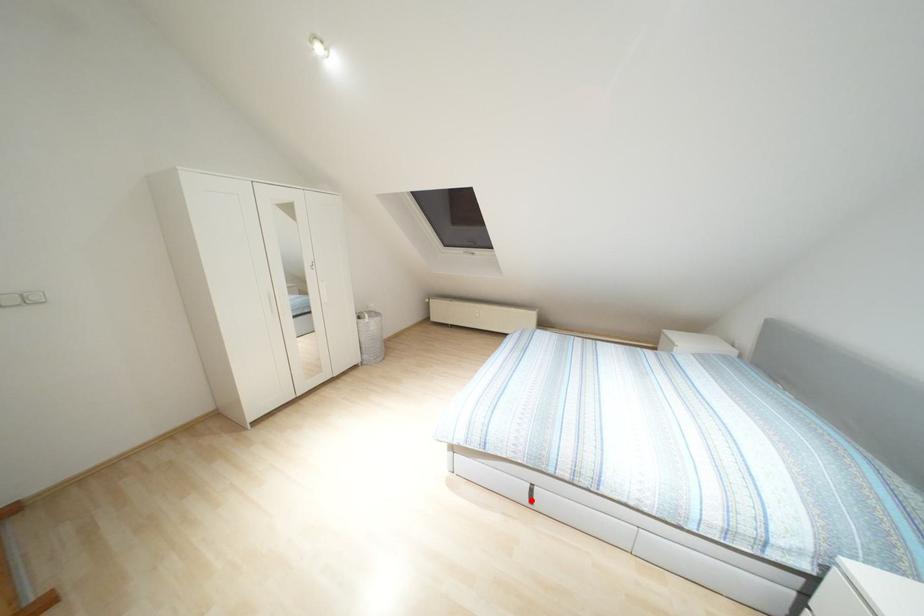
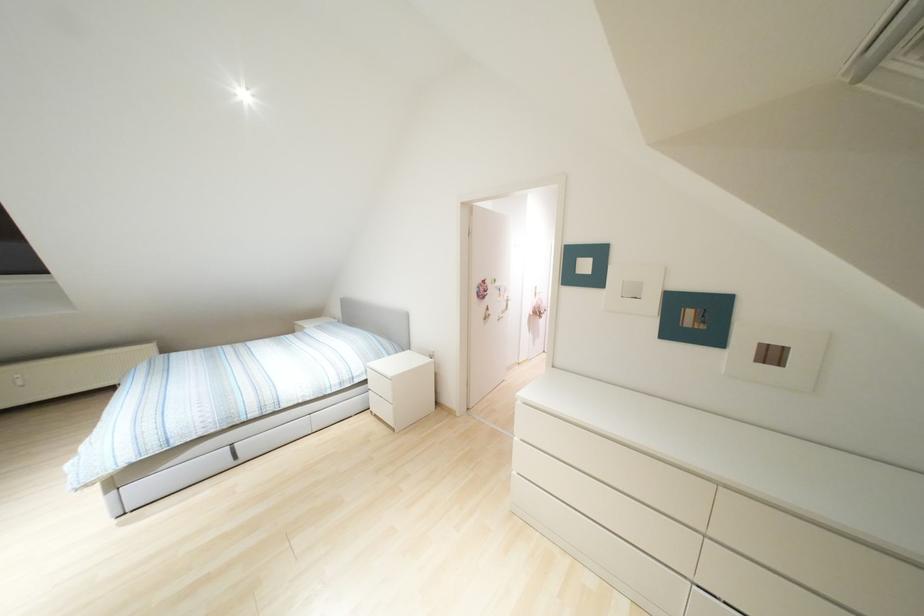
Where in the second image is the point corresponding to the highlighted location from the first image?

(235, 456)